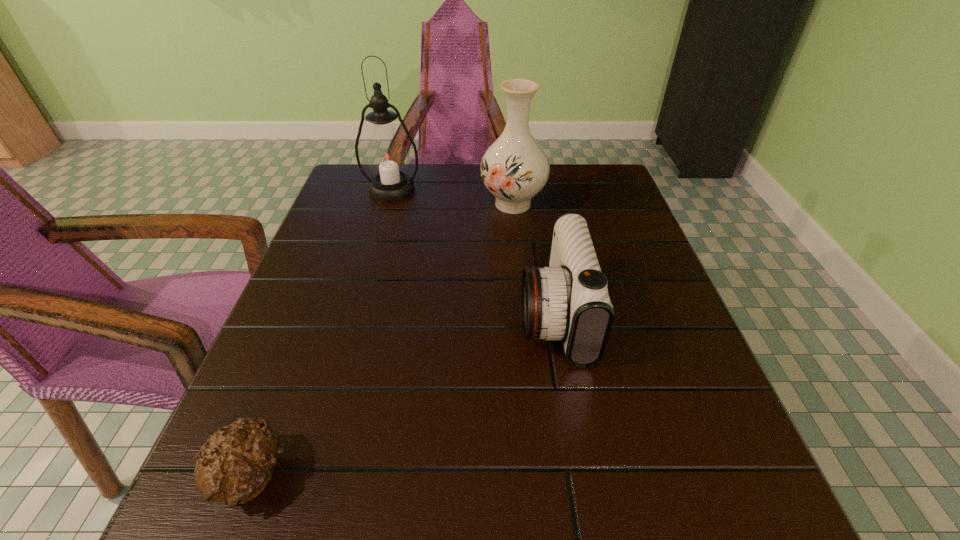
Identify the location of unoccupied position between the oil lamp and the camcorder. The image size is (960, 540). (473, 252).

I want to click on free space between the muffin and the third tallest object, so click(x=402, y=396).

Image resolution: width=960 pixels, height=540 pixels. What are the coordinates of `blank region between the vase and the oil lamp` in the screenshot? It's located at (452, 197).

What are the coordinates of `free space between the shortest object and the oil lamp` in the screenshot? It's located at (321, 333).

Identify the location of free spot between the vase and the camcorder. The width and height of the screenshot is (960, 540). (534, 259).

Identify the location of the third closest object relative to the oil lamp. (233, 466).

In order to click on object that can be found as the closest to the third farthest object in this screenshot , I will do `click(515, 168)`.

Locate an element on the screen. vacant space that satisfies the following two spatial constraints: 1. on the back side of the nearest object; 2. on the left side of the vase is located at coordinates (354, 204).

Where is `vacant region that satisfies the following two spatial constraints: 1. on the back side of the muffin; 2. on the left side of the vase`? The height and width of the screenshot is (540, 960). vacant region that satisfies the following two spatial constraints: 1. on the back side of the muffin; 2. on the left side of the vase is located at coordinates (354, 204).